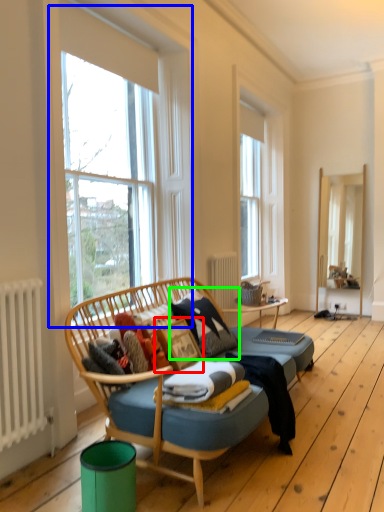
Question: Which is farther away from picture frame (highlighted by a red box)? window (highlighted by a blue box) or pillow (highlighted by a green box)?

Choices:
 (A) window
 (B) pillow

Answer: (A)